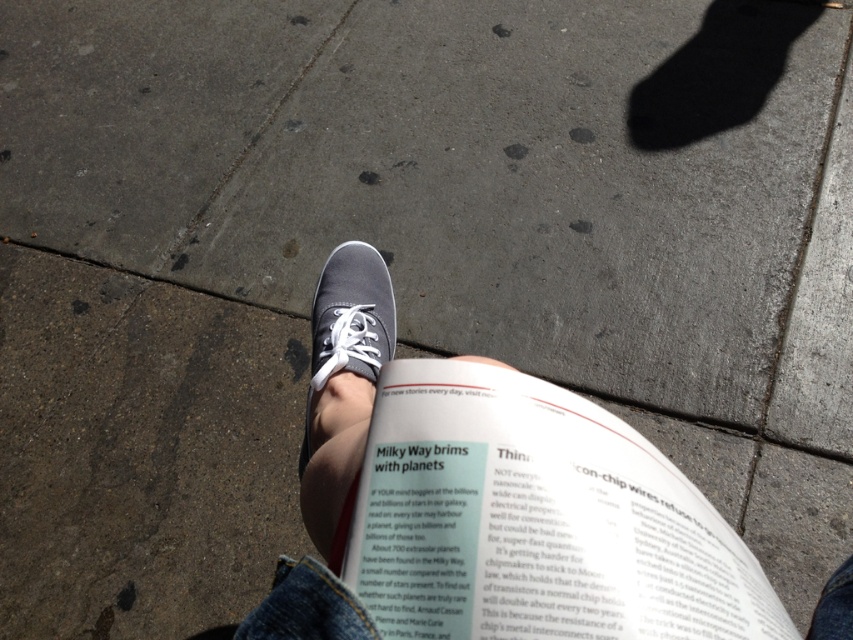
Question: Is white paper at center wider than matte gray sneaker at center?

Choices:
 (A) yes
 (B) no

Answer: (A)

Question: Is white paper at center bigger than matte gray sneaker at center?

Choices:
 (A) no
 (B) yes

Answer: (A)

Question: Which point appears closest to the camera in this image?

Choices:
 (A) (466, 472)
 (B) (318, 337)

Answer: (A)

Question: Which point is farther to the camera?

Choices:
 (A) matte gray sneaker at center
 (B) white paper at center

Answer: (A)

Question: Is white paper at center smaller than matte gray sneaker at center?

Choices:
 (A) yes
 (B) no

Answer: (A)

Question: Among these points, which one is nearest to the camera?

Choices:
 (A) (515, 573)
 (B) (364, 337)

Answer: (A)